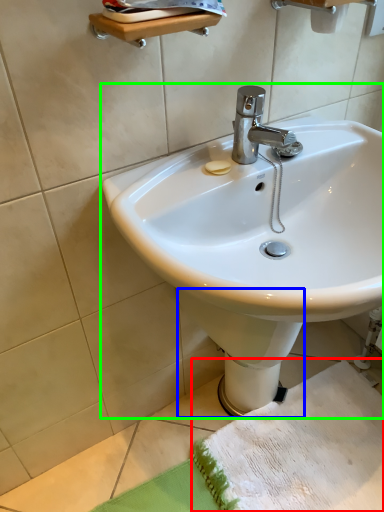
Question: Which object is positioned farthest from beach towel (highlighted by a red box)? Select from bidet (highlighted by a blue box) and sink (highlighted by a green box).

Choices:
 (A) bidet
 (B) sink

Answer: (B)